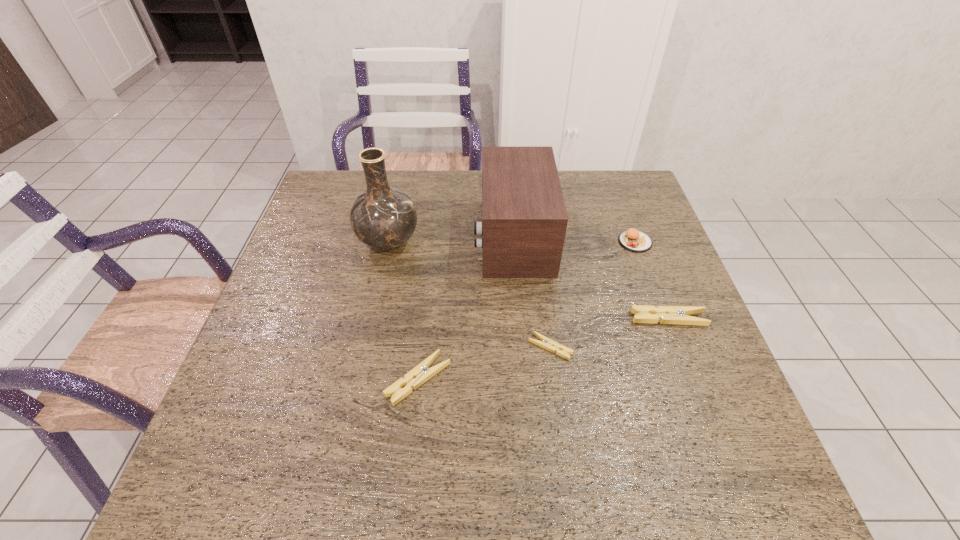
Where is `free space between the rightmost clothespin and the patty`? free space between the rightmost clothespin and the patty is located at coordinates (652, 280).

The width and height of the screenshot is (960, 540). I want to click on vacant region between the fourth shortest object and the fifth tallest object, so click(527, 310).

You are a GUI agent. You are given a task and a screenshot of the screen. Output one action in this format:
    pyautogui.click(x=<x>, y=<y>)
    Task: Click on the vacant area that lies between the fourth farthest object and the leftmost clothespin
    
    Given the screenshot: What is the action you would take?
    pyautogui.click(x=543, y=349)

Where is `vacant area that lies between the rightmost clothespin and the patty`? vacant area that lies between the rightmost clothespin and the patty is located at coordinates point(652,280).

Identify the location of free space between the leftmost clothespin and the second clothespin from left to right. The image size is (960, 540). (484, 363).

Find the location of a particular element. free space between the rightmost clothespin and the second clothespin from right to left is located at coordinates (610, 333).

I want to click on object that is the fourth closest to the fourth shortest object, so click(384, 218).

Select which object is the second closest to the leftmost clothespin. Please provide its 2D coordinates. Your answer should be formatted as a tuple, i.e. [(x, y)], where the tuple contains the x and y coordinates of a point satisfying the conditions above.

[(524, 220)]

Identify which clothespin is the nearest to the shortest object. Please provide its 2D coordinates. Your answer should be formatted as a tuple, i.e. [(x, y)], where the tuple contains the x and y coordinates of a point satisfying the conditions above.

[(678, 315)]

Locate an element on the screen. Image resolution: width=960 pixels, height=540 pixels. clothespin that stands as the closest to the third nearest object is located at coordinates (546, 343).